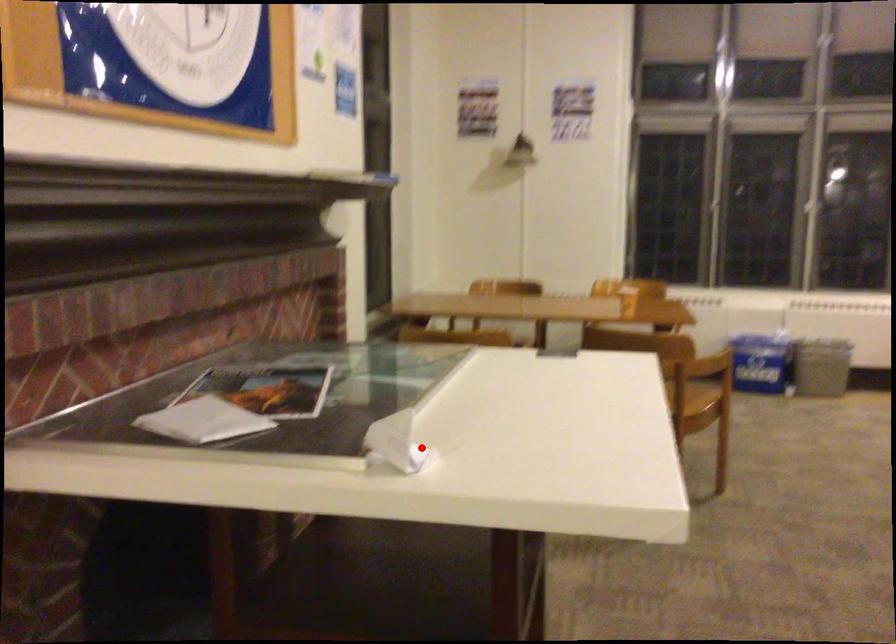
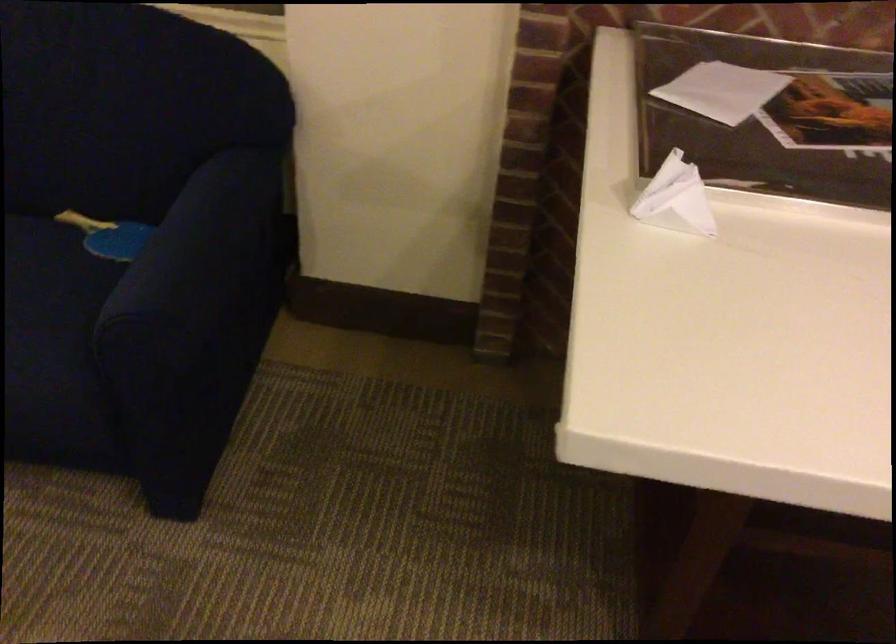
In the second image, find the point that corresponds to the highlighted location in the first image.

(675, 199)